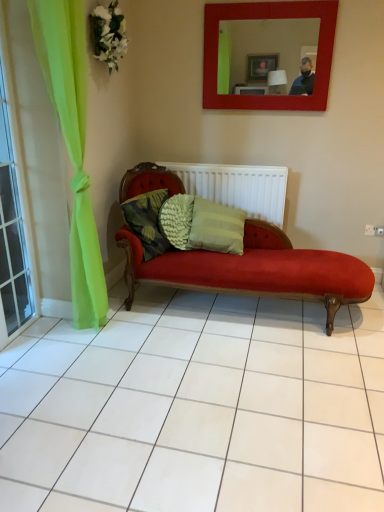
Measure the distance between point (241,199) and camera.

10.58 feet.

Identify the location of white fabric flower at upper left. (108, 34).

Between matte red mirror at upper center and clear glass window at left, which one has less height?

With less height is matte red mirror at upper center.

This screenshot has width=384, height=512. Identify the location of window on the left of matte red mirror at upper center. (14, 224).

How different are the orientations of matte red mirror at upper center and clear glass window at left in degrees?

matte red mirror at upper center and clear glass window at left are facing 87.1 degrees away from each other.

Is white fabric flower at upper left at the back of white textured radiator at center?

white textured radiator at center is not turned away from white fabric flower at upper left.

Does point (263, 203) come behind point (91, 45)?

That is True.

Looking at this image, which object is further away from the camera taking this photo, white textured radiator at center or white fabric flower at upper left?

white textured radiator at center is further away from the camera.

Can you confirm if white textured radiator at center is positioned to the left of white fabric flower at upper left?

Incorrect, white textured radiator at center is not on the left side of white fabric flower at upper left.

Considering the relative sizes of white fabric flower at upper left and white textured radiator at center in the image provided, is white fabric flower at upper left smaller than white textured radiator at center?

Yes.

Is white fabric flower at upper left shorter than white textured radiator at center?

Indeed, white fabric flower at upper left has a lesser height compared to white textured radiator at center.

Which object is closer to the camera, white fabric flower at upper left or white textured radiator at center?

→ white fabric flower at upper left.

Considering the relative positions of white fabric flower at upper left and white textured radiator at center in the image provided, is white fabric flower at upper left to the left or to the right of white textured radiator at center?

From the image, it's evident that white fabric flower at upper left is to the left of white textured radiator at center.

Is clear glass window at left aimed at textured green pillow at center?

No, clear glass window at left is not aimed at textured green pillow at center.

Considering the sizes of objects clear glass window at left and textured green pillow at center in the image provided, who is smaller, clear glass window at left or textured green pillow at center?

Smaller between the two is textured green pillow at center.

Considering the relative sizes of clear glass window at left and textured green pillow at center in the image provided, is clear glass window at left wider than textured green pillow at center?

Incorrect, the width of clear glass window at left does not surpass that of textured green pillow at center.

How different are the orientations of clear glass window at left and textured green pillow at center in degrees?

The angular difference between clear glass window at left and textured green pillow at center is 11.4 degrees.

Is point (242, 178) positioned in front of point (18, 209)?

No, it is behind (18, 209).

Is the position of white textured radiator at center less distant than that of clear glass window at left?

That is False.

Is white textured radiator at center to the left or to the right of clear glass window at left in the image?

Clearly, white textured radiator at center is on the right of clear glass window at left in the image.

Does white textured radiator at center contain clear glass window at left?

No, clear glass window at left is not surrounded by white textured radiator at center.

Between point (153, 211) and point (227, 26), which one is positioned in front?

The point (153, 211) is more forward.

I want to click on mirror that is above the textured green pillow at center (from a real-world perspective), so pos(269,42).

Can you confirm if textured green pillow at center is bigger than matte red mirror at upper center?

No.

From the image's perspective, is clear glass window at left on white fabric flower at upper left?

No, from the image's perspective, clear glass window at left is not on top of white fabric flower at upper left.

How different are the orientations of clear glass window at left and white fabric flower at upper left in degrees?

There is a 7.99-degree angle between the facing directions of clear glass window at left and white fabric flower at upper left.

Measure the distance between clear glass window at left and white fabric flower at upper left.

clear glass window at left and white fabric flower at upper left are 36.35 inches apart from each other.

Is clear glass window at left next to white fabric flower at upper left and touching it?

No, clear glass window at left is not with white fabric flower at upper left.

Locate an element on the screen. Image resolution: width=384 pixels, height=512 pixels. window on the left of matte red mirror at upper center is located at coordinates (14, 224).

At what (x,y) coordinates should I click in order to perform the action: click on radiator on the right of white fabric flower at upper left. Please return your answer as a coordinate pair (x, y). This screenshot has height=512, width=384. Looking at the image, I should click on coord(237,187).

Looking at the image, which one is located closer to matte red mirror at upper center, white textured radiator at center or clear glass window at left?

The object closer to matte red mirror at upper center is white textured radiator at center.

From the image, which object appears to be nearer to clear glass window at left, textured green pillow at center or matte red mirror at upper center?

textured green pillow at center.

Based on their spatial positions, is textured green pillow at center or white textured radiator at center further from clear glass window at left?

Based on the image, white textured radiator at center appears to be further to clear glass window at left.

Looking at the image, which one is located closer to textured green pillow at center, matte red mirror at upper center or white textured radiator at center?

white textured radiator at center is closer to textured green pillow at center.

From the image, which object appears to be farther from white fabric flower at upper left, textured green pillow at center or matte red mirror at upper center?

The object further to white fabric flower at upper left is textured green pillow at center.

Consider the image. When comparing their distances from matte red mirror at upper center, does textured green pillow at center or white fabric flower at upper left seem closer?

Among the two, white fabric flower at upper left is located nearer to matte red mirror at upper center.

Looking at this image, from the image, which object appears to be farther from textured green pillow at center, white fabric flower at upper left or matte red mirror at upper center?

Based on the image, matte red mirror at upper center appears to be further to textured green pillow at center.

Which object lies nearer to the anchor point textured green pillow at center, white textured radiator at center or clear glass window at left?

Based on the image, white textured radiator at center appears to be nearer to textured green pillow at center.

Image resolution: width=384 pixels, height=512 pixels. I want to click on flower situated between clear glass window at left and matte red mirror at upper center from left to right, so click(x=108, y=34).

This screenshot has width=384, height=512. In order to click on pillow between clear glass window at left and white textured radiator at center in the front-back direction in this screenshot , I will do `click(147, 221)`.

The height and width of the screenshot is (512, 384). What are the coordinates of `flower between matte red mirror at upper center and textured green pillow at center in the vertical direction` in the screenshot? It's located at (108, 34).

You are a GUI agent. You are given a task and a screenshot of the screen. Output one action in this format:
    pyautogui.click(x=<x>, y=<y>)
    Task: Click on the flower between clear glass window at left and white textured radiator at center from front to back
    The width and height of the screenshot is (384, 512).
    Given the screenshot: What is the action you would take?
    pyautogui.click(x=108, y=34)